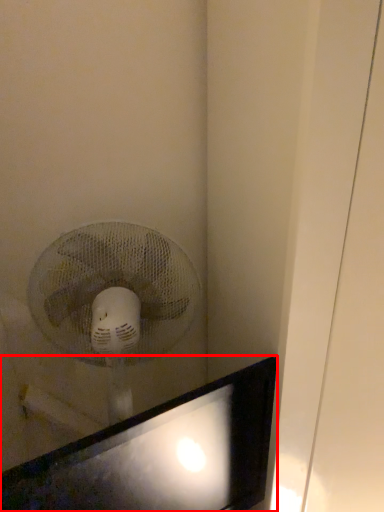
Question: Observing the image, what is the correct spatial positioning of computer monitor (annotated by the red box) in reference to mechanical fan?

Choices:
 (A) left
 (B) right

Answer: (B)